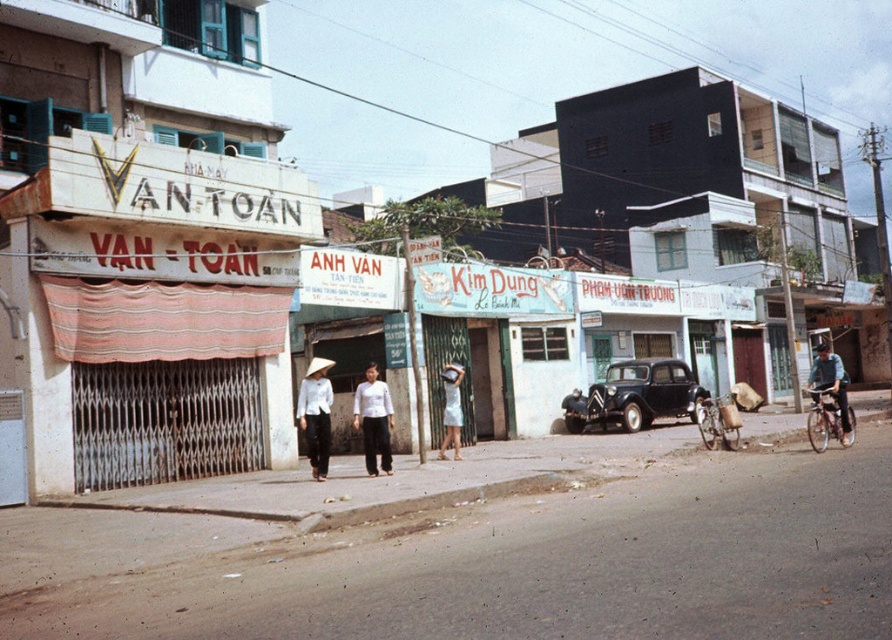
Question: Which object appears farthest from the camera in this image?

Choices:
 (A) white matte pants at center
 (B) white satin dress at center

Answer: (B)

Question: Does white matte hat at center have a larger size compared to shiny metallic bicycle at right?

Choices:
 (A) no
 (B) yes

Answer: (A)

Question: In this image, where is matte black car at center-right located relative to shiny metallic bicycle at right?

Choices:
 (A) above
 (B) below

Answer: (A)

Question: Can you confirm if white matte pants at center is positioned to the right of metallic silver bicycle at center-right?

Choices:
 (A) no
 (B) yes

Answer: (A)

Question: Considering the real-world distances, which object is closest to the white matte hat at center?

Choices:
 (A) metallic silver bicycle at center-right
 (B) white satin dress at center
 (C) light blue denim jacket at right
 (D) shiny metallic bicycle at right

Answer: (B)

Question: Estimate the real-world distances between objects in this image. Which object is closer to the light blue denim jacket at right?

Choices:
 (A) matte black car at center-right
 (B) white matte hat at center
 (C) metallic silver bicycle at center-right

Answer: (C)